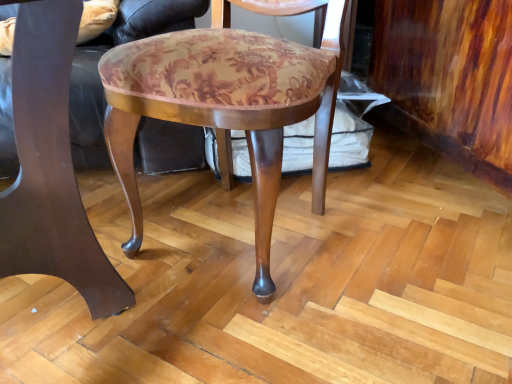
The width and height of the screenshot is (512, 384). In order to click on vacant area that lies to the right of wooden chair at center, the first chair when ordered from right to left in this screenshot , I will do `click(387, 245)`.